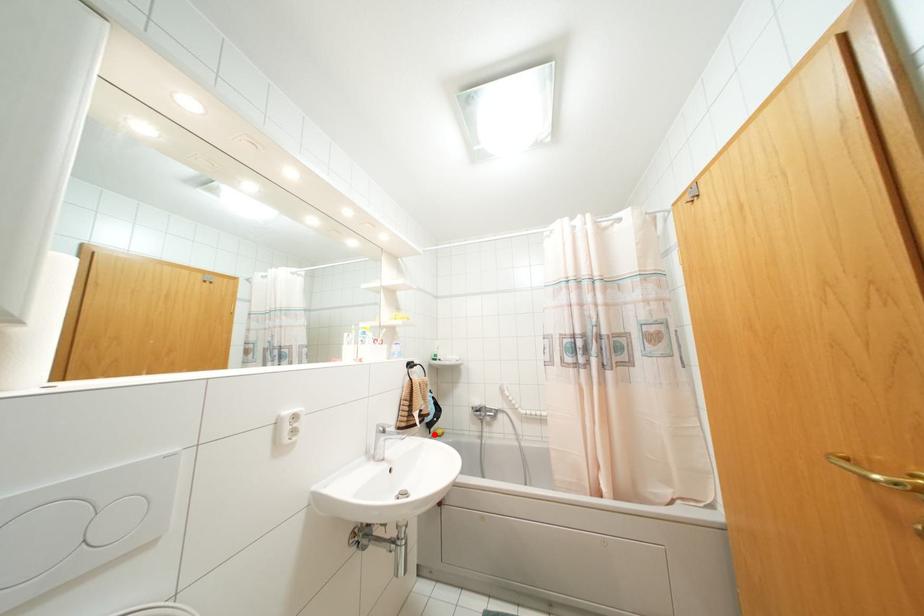
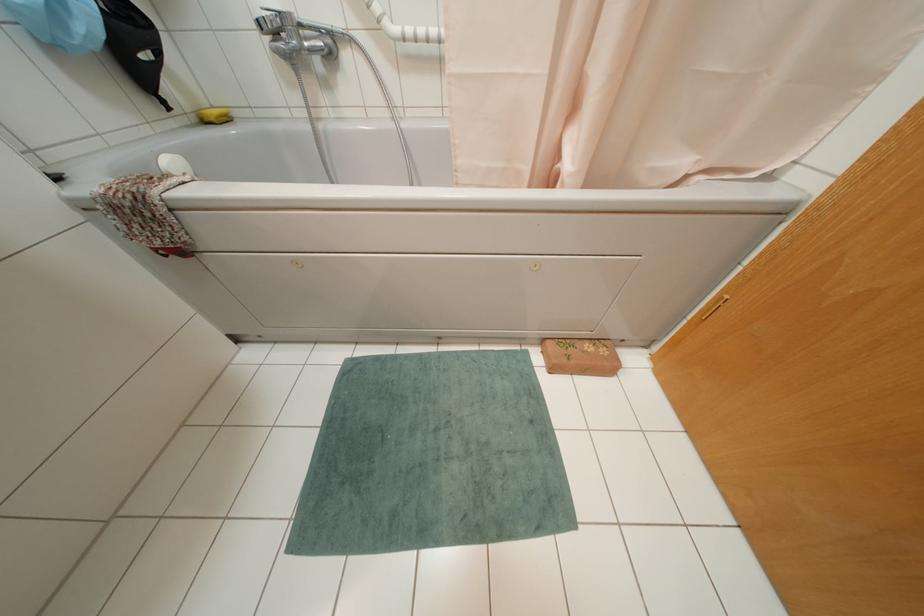
Question: A red point is marked in image1. In image2, is the corresponding 3D point closer to the camera or farther? Reply with the corresponding letter.

Choices:
 (A) The corresponding 3D point is closer.
 (B) The corresponding 3D point is farther.

Answer: (A)